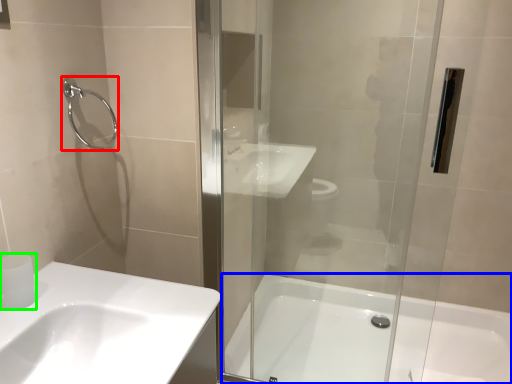
Question: Estimate the real-world distances between objects in this image. Which object is farther from shower (highlighted by a red box), bathtub (highlighted by a blue box) or toilet paper (highlighted by a green box)?

Choices:
 (A) bathtub
 (B) toilet paper

Answer: (A)